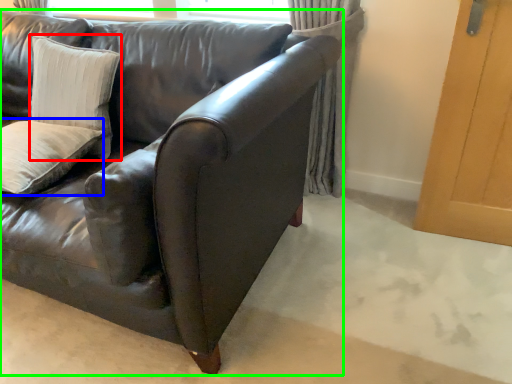
Question: Estimate the real-world distances between objects in this image. Which object is closer to pillow (highlighted by a red box), pillow (highlighted by a blue box) or studio couch (highlighted by a green box)?

Choices:
 (A) pillow
 (B) studio couch

Answer: (A)